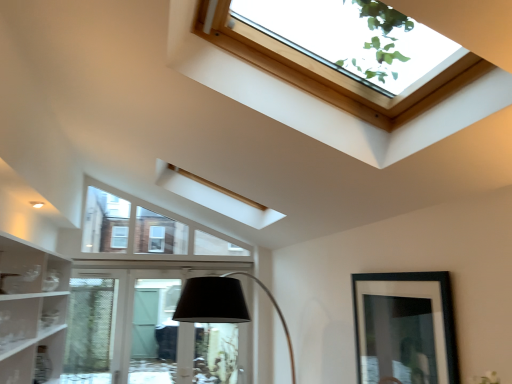
Question: From the image's perspective, is wooden frame skylight at upper center on clear glass door at lower center?

Choices:
 (A) no
 (B) yes

Answer: (B)

Question: Is wooden frame skylight at upper center behind clear glass door at lower center?

Choices:
 (A) no
 (B) yes

Answer: (A)

Question: Is wooden frame skylight at upper center looking in the opposite direction of clear glass door at lower center?

Choices:
 (A) no
 (B) yes

Answer: (A)

Question: Does wooden frame skylight at upper center have a smaller size compared to clear glass door at lower center?

Choices:
 (A) no
 (B) yes

Answer: (A)

Question: From a real-world perspective, is wooden frame skylight at upper center over clear glass door at lower center?

Choices:
 (A) yes
 (B) no

Answer: (A)

Question: Is wooden frame skylight at upper center wider than clear glass door at lower center?

Choices:
 (A) yes
 (B) no

Answer: (A)

Question: Considering the relative sizes of clear glass door at lower center and black matte picture frame at lower right in the image provided, is clear glass door at lower center thinner than black matte picture frame at lower right?

Choices:
 (A) yes
 (B) no

Answer: (B)

Question: From a real-world perspective, is clear glass door at lower center located higher than black matte picture frame at lower right?

Choices:
 (A) no
 (B) yes

Answer: (A)

Question: From the image's perspective, is clear glass door at lower center below black matte picture frame at lower right?

Choices:
 (A) no
 (B) yes

Answer: (B)

Question: Is clear glass door at lower center oriented towards black matte picture frame at lower right?

Choices:
 (A) yes
 (B) no

Answer: (A)

Question: Considering the relative sizes of clear glass door at lower center and black matte picture frame at lower right in the image provided, is clear glass door at lower center smaller than black matte picture frame at lower right?

Choices:
 (A) yes
 (B) no

Answer: (B)

Question: Considering the relative positions of clear glass door at lower center and black matte picture frame at lower right in the image provided, is clear glass door at lower center to the left of black matte picture frame at lower right from the viewer's perspective?

Choices:
 (A) no
 (B) yes

Answer: (B)

Question: Is black matte picture frame at lower right facing towards wooden frame skylight at upper center?

Choices:
 (A) yes
 (B) no

Answer: (B)